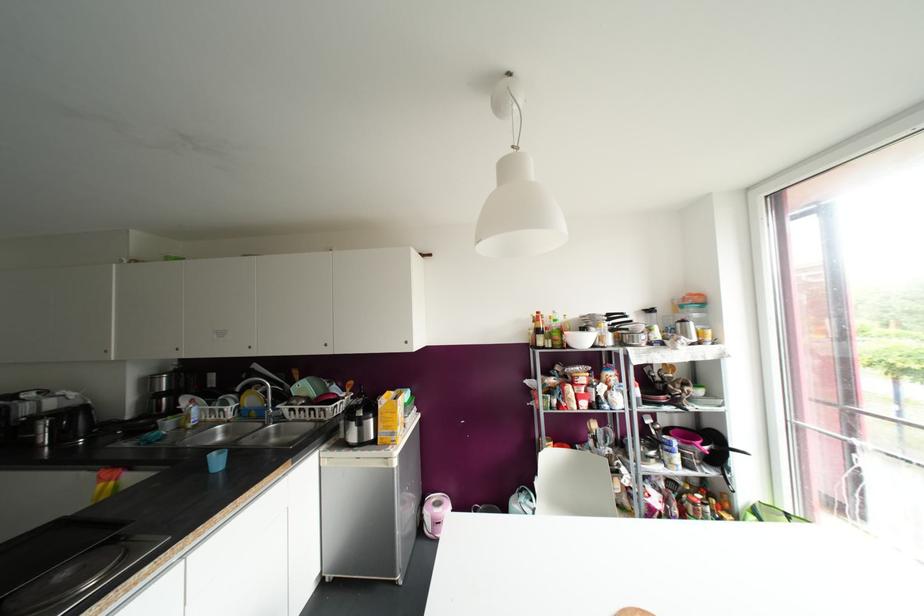
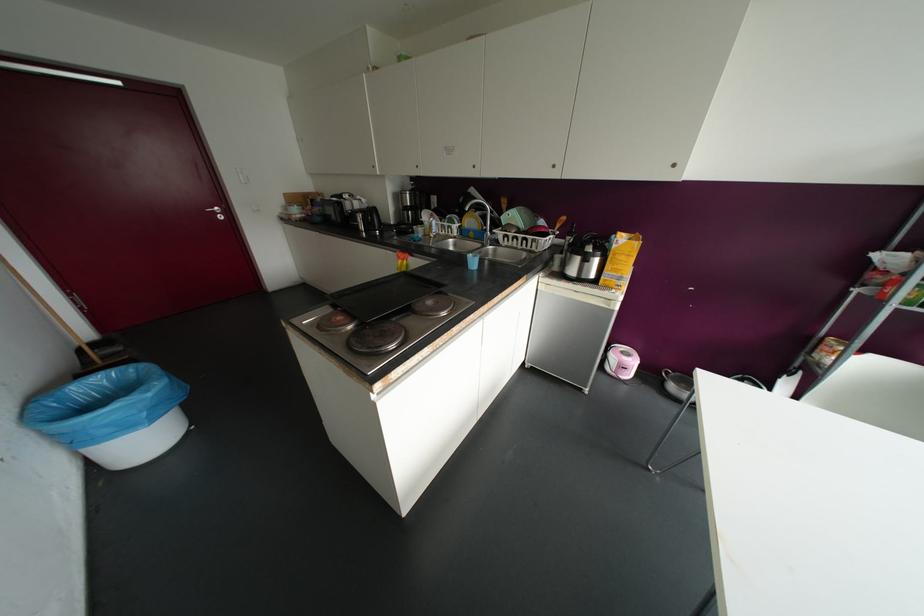
The first image is from the beginning of the video and the second image is from the end. How did the camera likely rotate when shooting the video?

The camera rotated toward left-down.